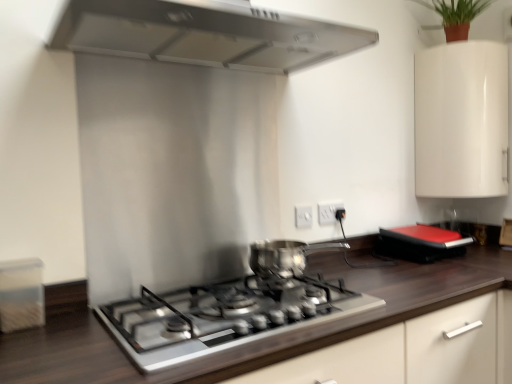
Question: Are white glossy cabinet at upper right and satin silver gas stove at center beside each other?

Choices:
 (A) yes
 (B) no

Answer: (B)

Question: Does white glossy cabinet at upper right have a greater height compared to satin silver gas stove at center?

Choices:
 (A) no
 (B) yes

Answer: (B)

Question: From a real-world perspective, is white glossy cabinet at upper right beneath satin silver gas stove at center?

Choices:
 (A) yes
 (B) no

Answer: (B)

Question: Is white glossy cabinet at upper right facing away from satin silver gas stove at center?

Choices:
 (A) yes
 (B) no

Answer: (B)

Question: Could you tell me if white glossy cabinet at upper right is turned towards satin silver gas stove at center?

Choices:
 (A) no
 (B) yes

Answer: (A)

Question: From the image's perspective, does white glossy cabinet at upper right appear higher than satin silver gas stove at center?

Choices:
 (A) no
 (B) yes

Answer: (B)

Question: Considering the relative sizes of dark wood countertop at center and white plastic electric outlet at center, which is counted as the 2th electric outlet, starting from the left, in the image provided, is dark wood countertop at center wider than white plastic electric outlet at center, which is counted as the 2th electric outlet, starting from the left,?

Choices:
 (A) no
 (B) yes

Answer: (B)

Question: Does dark wood countertop at center have a greater height compared to white plastic electric outlet at center, arranged as the second electric outlet when viewed from the front?

Choices:
 (A) no
 (B) yes

Answer: (B)

Question: Is dark wood countertop at center looking in the opposite direction of white plastic electric outlet at center, which is counted as the 2th electric outlet, starting from the left?

Choices:
 (A) no
 (B) yes

Answer: (A)

Question: From the image's perspective, is dark wood countertop at center under white plastic electric outlet at center, arranged as the second electric outlet when viewed from the front?

Choices:
 (A) no
 (B) yes

Answer: (B)

Question: Is dark wood countertop at center directly adjacent to white plastic electric outlet at center, acting as the 1th electric outlet starting from the right?

Choices:
 (A) no
 (B) yes

Answer: (A)

Question: Does dark wood countertop at center appear on the right side of white plastic electric outlet at center, placed as the first electric outlet when sorted from back to front?

Choices:
 (A) yes
 (B) no

Answer: (A)

Question: From a real-world perspective, is green matte plant at upper right located beneath dark wood countertop at center?

Choices:
 (A) yes
 (B) no

Answer: (B)